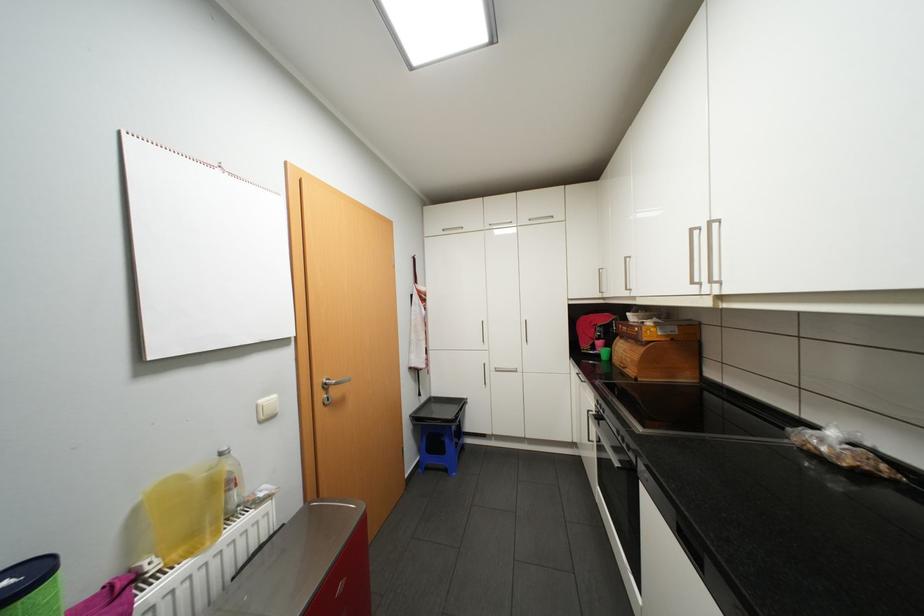
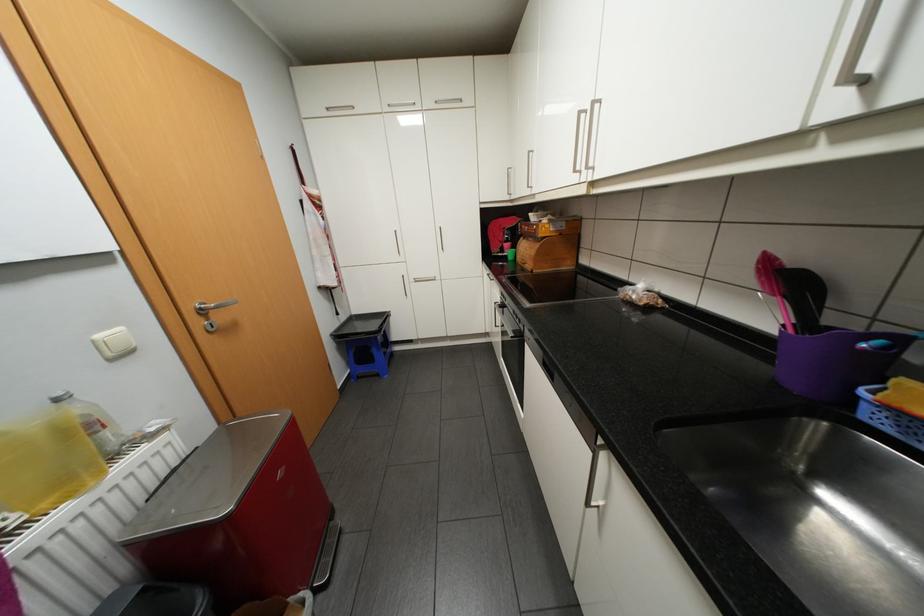
Where in the second image is the point corresponding to point (269, 400) from the first image?

(106, 334)